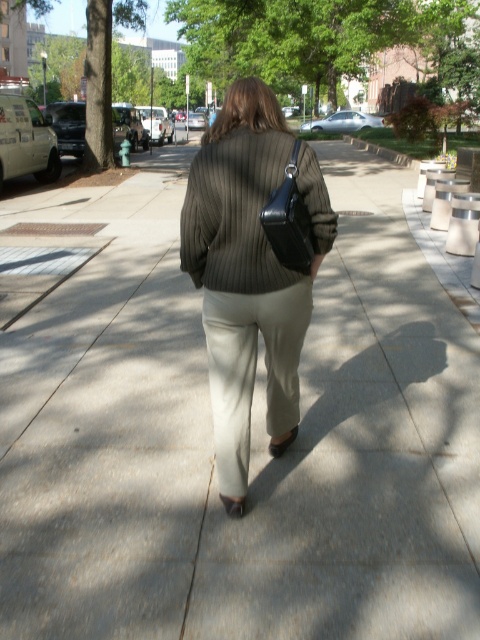
Question: Does ribbed sweater at center appear under black leather bag at center?

Choices:
 (A) no
 (B) yes

Answer: (B)

Question: In this image, where is ribbed wool sweater at center located relative to black leather bag at center?

Choices:
 (A) left
 (B) right

Answer: (A)

Question: Which of these objects is positioned closest to the black leather bag at center?

Choices:
 (A) ribbed wool sweater at center
 (B) ribbed sweater at center

Answer: (A)

Question: Does ribbed sweater at center come in front of ribbed wool sweater at center?

Choices:
 (A) no
 (B) yes

Answer: (A)

Question: Estimate the real-world distances between objects in this image. Which object is farther from the black leather bag at center?

Choices:
 (A) ribbed sweater at center
 (B) ribbed wool sweater at center

Answer: (A)

Question: Among these objects, which one is farthest from the camera?

Choices:
 (A) ribbed wool sweater at center
 (B) black leather bag at center

Answer: (A)